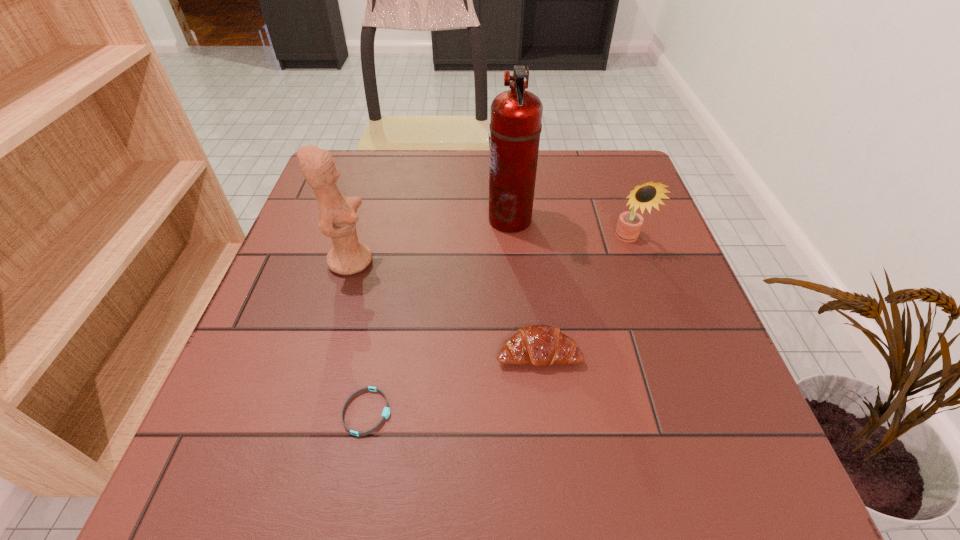
At what (x,y) coordinates should I click in order to perform the action: click on vacant space that is in between the fire extinguisher and the crescent roll. Please return your answer as a coordinate pair (x, y). Looking at the image, I should click on (524, 286).

What are the coordinates of `empty space that is in between the fourth shortest object and the fourth object from right to left` in the screenshot? It's located at (359, 336).

This screenshot has height=540, width=960. Identify the location of empty space between the crescent roll and the nearest object. (453, 382).

You are a GUI agent. You are given a task and a screenshot of the screen. Output one action in this format:
    pyautogui.click(x=<x>, y=<y>)
    Task: Click on the object that is the second closest to the leftmost object
    
    Given the screenshot: What is the action you would take?
    pyautogui.click(x=386, y=411)

This screenshot has height=540, width=960. I want to click on the second closest object to the sunflower, so click(x=540, y=345).

Locate an element on the screen. The height and width of the screenshot is (540, 960). vacant space that satisfies the following two spatial constraints: 1. on the side of the fourth tallest object with the handle and hose; 2. on the left side of the fire extinguisher is located at coordinates (520, 353).

At what (x,y) coordinates should I click in order to perform the action: click on free point that satisfies the following two spatial constraints: 1. on the face of the sunflower; 2. on the buckle of the wristband. Please return your answer as a coordinate pair (x, y). The height and width of the screenshot is (540, 960). Looking at the image, I should click on (689, 412).

Where is `vacant region that satisfies the following two spatial constraints: 1. on the front side of the fourth tallest object; 2. on the buckle of the nearest object`? vacant region that satisfies the following two spatial constraints: 1. on the front side of the fourth tallest object; 2. on the buckle of the nearest object is located at coordinates click(x=545, y=412).

Locate an element on the screen. The width and height of the screenshot is (960, 540). free space that satisfies the following two spatial constraints: 1. on the front side of the second shortest object; 2. on the buckle of the nearest object is located at coordinates (545, 412).

Where is `free space in the image that satisfies the following two spatial constraints: 1. on the front-facing side of the crescent roll; 2. on the left side of the second tallest object`? Image resolution: width=960 pixels, height=540 pixels. free space in the image that satisfies the following two spatial constraints: 1. on the front-facing side of the crescent roll; 2. on the left side of the second tallest object is located at coordinates (324, 353).